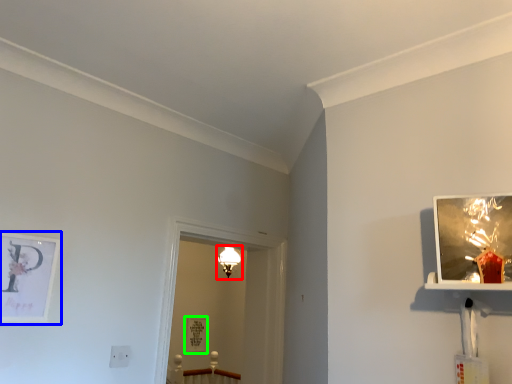
Question: Estimate the real-world distances between objects in this image. Which object is farther from light fixture (highlighted by a red box), picture frame (highlighted by a blue box) or picture frame (highlighted by a green box)?

Choices:
 (A) picture frame
 (B) picture frame

Answer: (B)